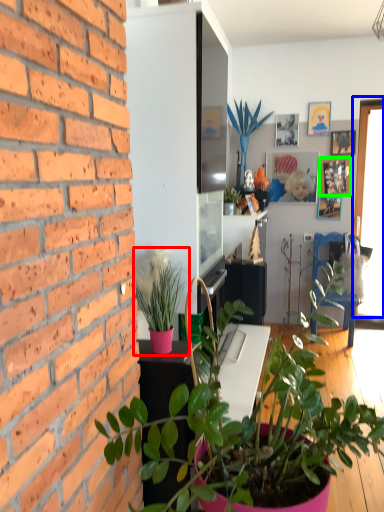
Question: Considering the real-world distances, which object is closest to houseplant (highlighted by a red box)? window (highlighted by a blue box) or picture frame (highlighted by a green box).

Choices:
 (A) window
 (B) picture frame

Answer: (A)